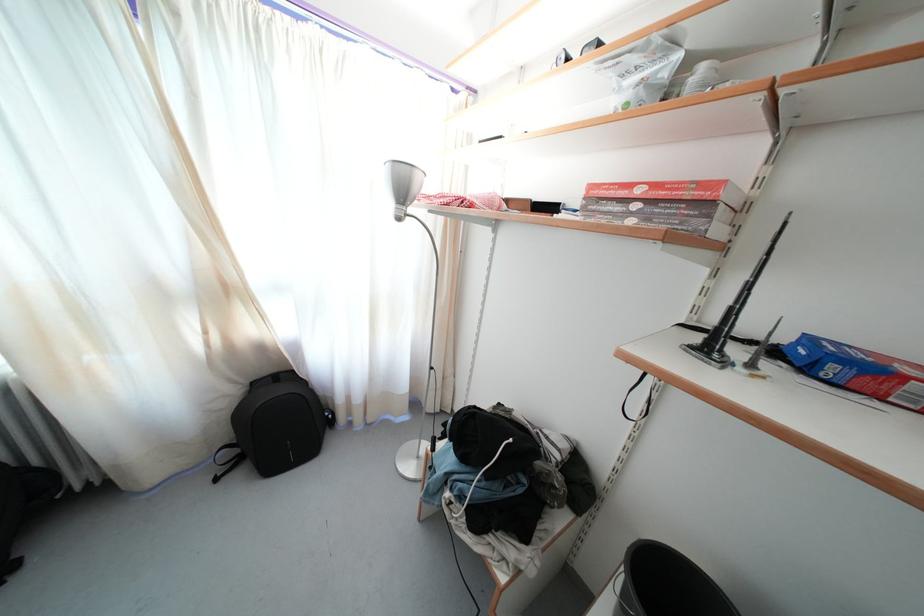
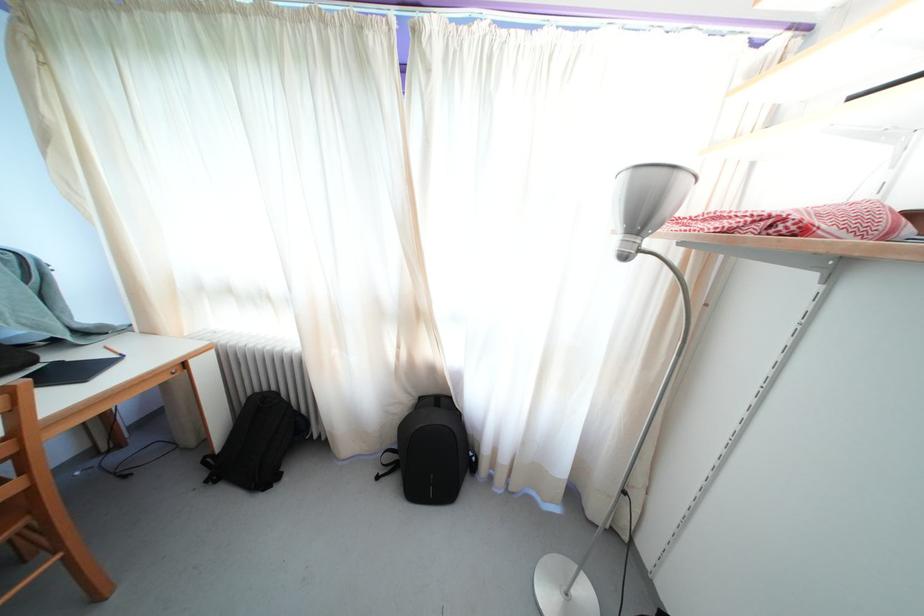
Locate, in the second image, the point that corresponds to point (229, 297) in the first image.

(421, 321)